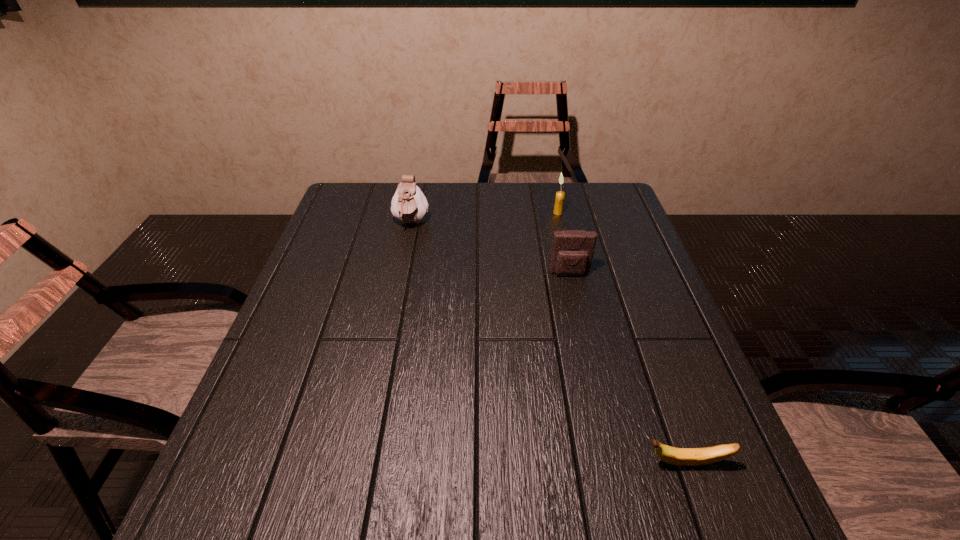
You are a GUI agent. You are given a task and a screenshot of the screen. Output one action in this format:
    pyautogui.click(x=<x>, y=<y>)
    Task: Click on the object that is the third closest to the second nearest object
    The height and width of the screenshot is (540, 960).
    Given the screenshot: What is the action you would take?
    pyautogui.click(x=676, y=456)